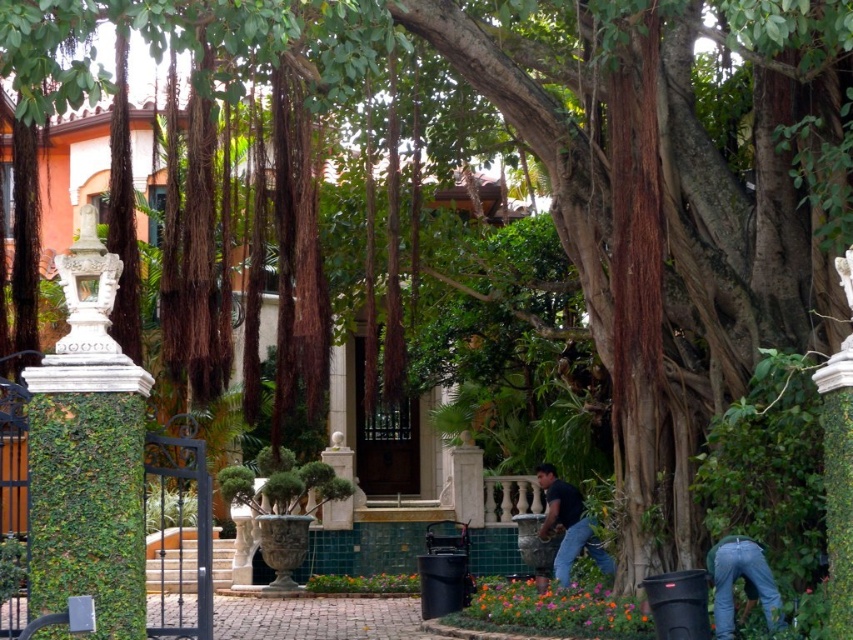
Question: Does denim jeans at lower right appear on the left side of dark blue t-shirt at lower center?

Choices:
 (A) no
 (B) yes

Answer: (A)

Question: Which point is closer to the camera taking this photo?

Choices:
 (A) (755, 589)
 (B) (560, 548)

Answer: (A)

Question: Which point is farther from the camera taking this photo?

Choices:
 (A) (735, 540)
 (B) (566, 582)

Answer: (B)

Question: Observing the image, what is the correct spatial positioning of denim jeans at lower right in reference to dark blue t-shirt at lower center?

Choices:
 (A) left
 (B) right

Answer: (B)

Question: Which of the following is the farthest from the observer?

Choices:
 (A) dark blue t-shirt at lower center
 (B) denim jeans at lower right

Answer: (A)

Question: Is denim jeans at lower right to the right of dark blue t-shirt at lower center from the viewer's perspective?

Choices:
 (A) no
 (B) yes

Answer: (B)